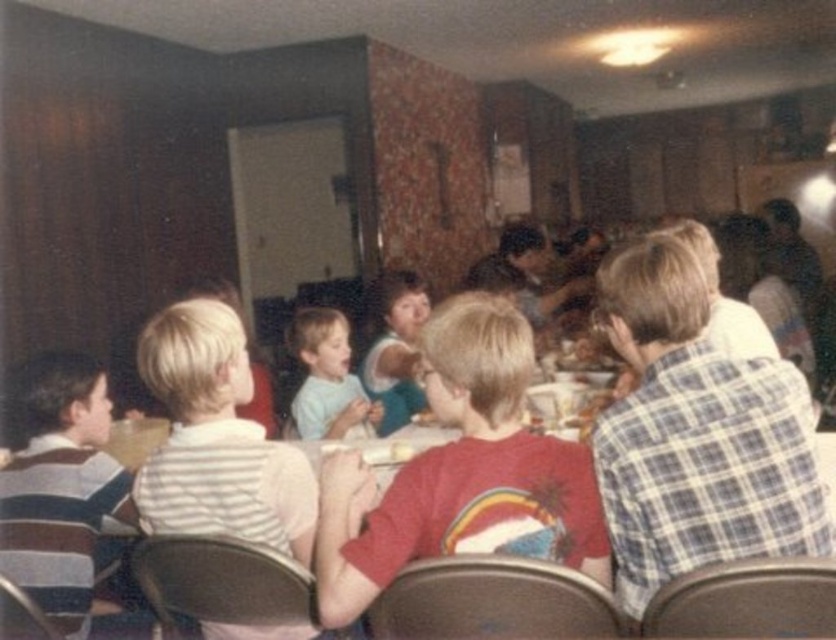
Between red plaid shirt at center and light blue shirt at center, which one appears on the right side from the viewer's perspective?

red plaid shirt at center

Based on the photo, can you confirm if red plaid shirt at center is taller than light blue shirt at center?

Indeed, red plaid shirt at center has a greater height compared to light blue shirt at center.

At what (x,y) coordinates should I click in order to perform the action: click on red plaid shirt at center. Please return your answer as a coordinate pair (x, y). Looking at the image, I should click on (461, 472).